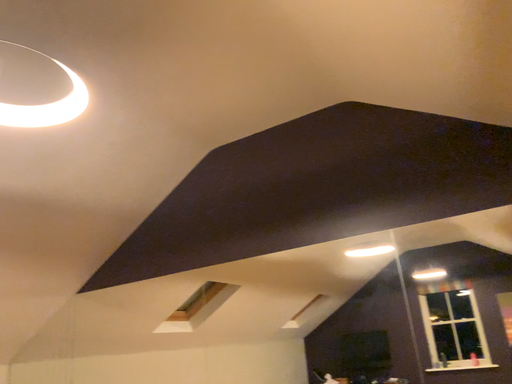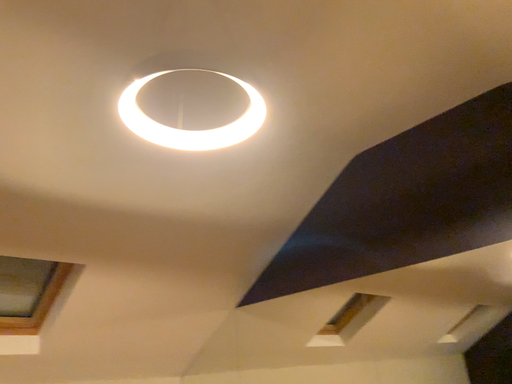
Question: Which way did the camera rotate in the video?

Choices:
 (A) rotated left
 (B) rotated right

Answer: (A)